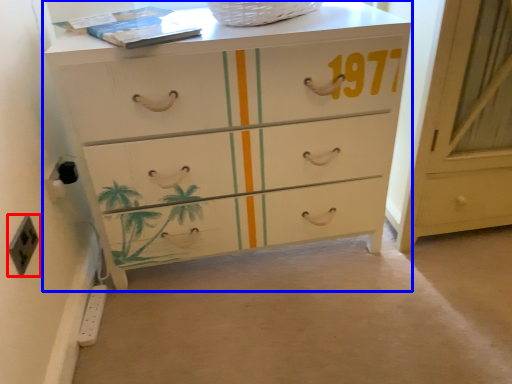
Question: Which point is closer to the camera, electric outlet (highlighted by a red box) or chest of drawers (highlighted by a blue box)?

Choices:
 (A) electric outlet
 (B) chest of drawers

Answer: (A)